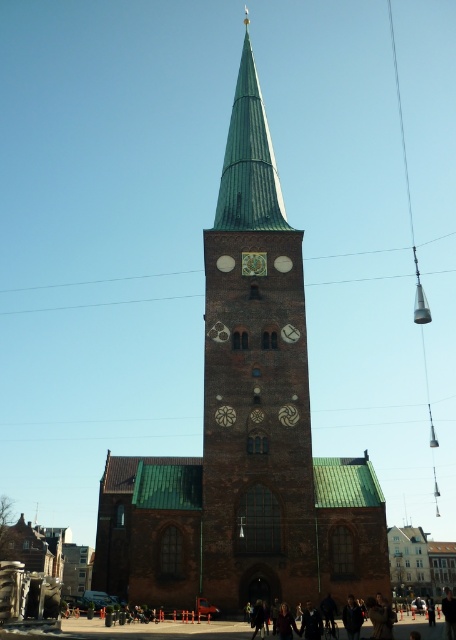
Between brown stone church at center and green copper spire at center, which one is positioned lower?

brown stone church at center is lower down.

Does brown stone church at center appear under green copper spire at center?

Indeed, brown stone church at center is positioned under green copper spire at center.

Who is more forward, (279, 545) or (258, 188)?

Positioned in front is point (279, 545).

At what (x,y) coordinates should I click in order to perform the action: click on brown stone church at center. Please return your answer as a coordinate pair (x, y). This screenshot has height=640, width=456. Looking at the image, I should click on (245, 429).

Is green copper spire at center positioned behind gold textured clock at center?

Yes, green copper spire at center is further from the viewer.

This screenshot has height=640, width=456. Identify the location of green copper spire at center. (248, 160).

This screenshot has height=640, width=456. Find the location of `green copper spire at center`. green copper spire at center is located at coordinates (248, 160).

Where is `green copper spire at center`? The width and height of the screenshot is (456, 640). green copper spire at center is located at coordinates (248, 160).

Between brown stone church at center and green stone church tower at center, which one has more height?

brown stone church at center is taller.

Which is below, brown stone church at center or green stone church tower at center?

brown stone church at center

Which is behind, point (267, 285) or point (234, 552)?

The point (267, 285) is behind.

Locate an element on the screen. The image size is (456, 640). brown stone church at center is located at coordinates (245, 429).